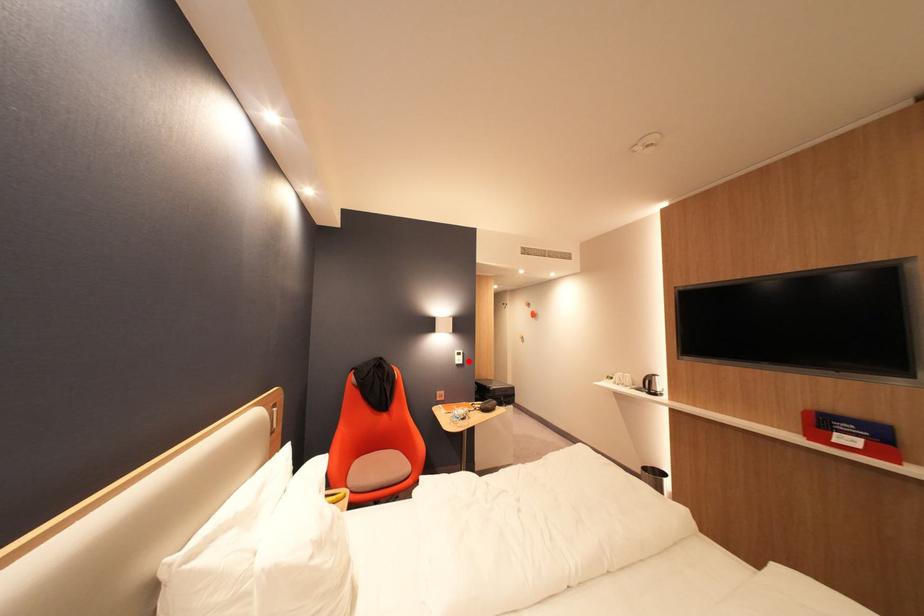
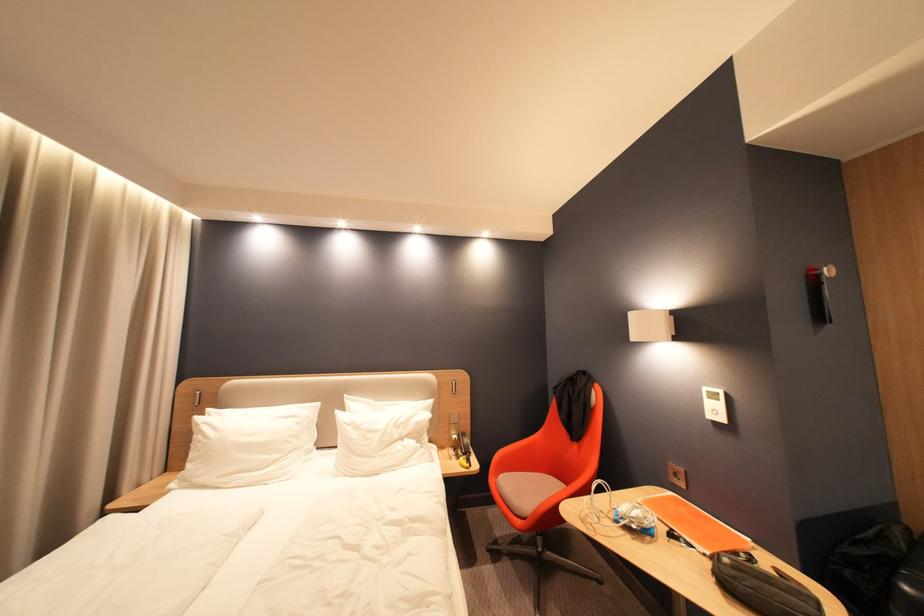
The point at the highlighted location is marked in the first image. Where is the corresponding point in the second image?

(724, 413)